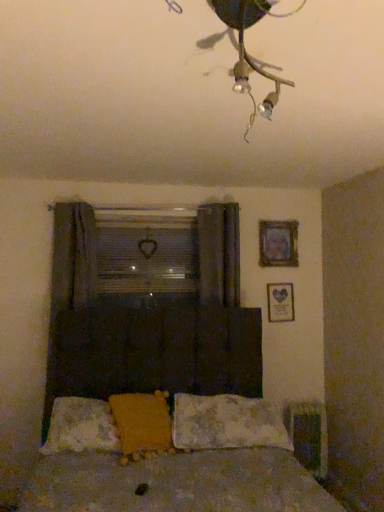
Question: From the image's perspective, is dark fabric curtain at center, the first curtain positioned from the right, on matte silver picture frame at upper right, marked as the first picture frame in a bottom-to-top arrangement?

Choices:
 (A) no
 (B) yes

Answer: (B)

Question: Is dark fabric curtain at center, which appears as the 2th curtain when viewed from the left, oriented away from matte silver picture frame at upper right, which appears as the 2th picture frame when viewed from the top?

Choices:
 (A) yes
 (B) no

Answer: (B)

Question: From a real-world perspective, is dark fabric curtain at center, the first curtain positioned from the right, over matte silver picture frame at upper right, which appears as the 2th picture frame when viewed from the top?

Choices:
 (A) yes
 (B) no

Answer: (A)

Question: Is dark fabric curtain at center, the first curtain positioned from the right, facing towards matte silver picture frame at upper right, marked as the first picture frame in a bottom-to-top arrangement?

Choices:
 (A) no
 (B) yes

Answer: (A)

Question: Considering the relative sizes of dark fabric curtain at center, which appears as the 2th curtain when viewed from the left, and matte silver picture frame at upper right, which appears as the 2th picture frame when viewed from the top, in the image provided, is dark fabric curtain at center, which appears as the 2th curtain when viewed from the left, thinner than matte silver picture frame at upper right, which appears as the 2th picture frame when viewed from the top,?

Choices:
 (A) yes
 (B) no

Answer: (B)

Question: Is dark fabric curtain at center, the first curtain positioned from the right, at the left side of matte silver picture frame at upper right, which appears as the 2th picture frame when viewed from the top?

Choices:
 (A) yes
 (B) no

Answer: (A)

Question: Can you confirm if matte silver picture frame at upper right, marked as the first picture frame in a bottom-to-top arrangement, is shorter than fluffy white pillow at lower center, the first pillow from the left?

Choices:
 (A) yes
 (B) no

Answer: (B)

Question: Can you confirm if matte silver picture frame at upper right, which appears as the 2th picture frame when viewed from the top, is bigger than fluffy white pillow at lower center, the first pillow from the left?

Choices:
 (A) no
 (B) yes

Answer: (A)

Question: Is matte silver picture frame at upper right, which appears as the 2th picture frame when viewed from the top, wider than fluffy white pillow at lower center, the first pillow from the left?

Choices:
 (A) yes
 (B) no

Answer: (B)

Question: Is fluffy white pillow at lower center, the first pillow from the left, inside matte silver picture frame at upper right, marked as the first picture frame in a bottom-to-top arrangement?

Choices:
 (A) yes
 (B) no

Answer: (B)

Question: Does matte silver picture frame at upper right, marked as the first picture frame in a bottom-to-top arrangement, lie behind fluffy white pillow at lower center, which appears as the third pillow when viewed from the right?

Choices:
 (A) yes
 (B) no

Answer: (A)

Question: Considering the relative sizes of matte silver picture frame at upper right, which appears as the 2th picture frame when viewed from the top, and fluffy white pillow at lower center, the first pillow from the left, in the image provided, is matte silver picture frame at upper right, which appears as the 2th picture frame when viewed from the top, thinner than fluffy white pillow at lower center, the first pillow from the left,?

Choices:
 (A) no
 (B) yes

Answer: (B)

Question: Is fluffy white pillow at lower center, which appears as the third pillow when viewed from the right, smaller than clear plastic window screen at center?

Choices:
 (A) yes
 (B) no

Answer: (B)